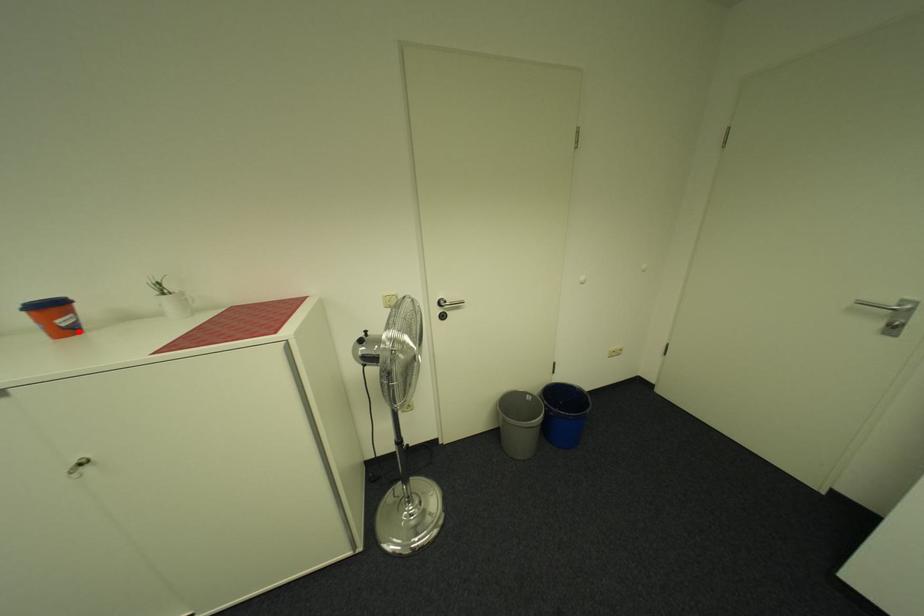
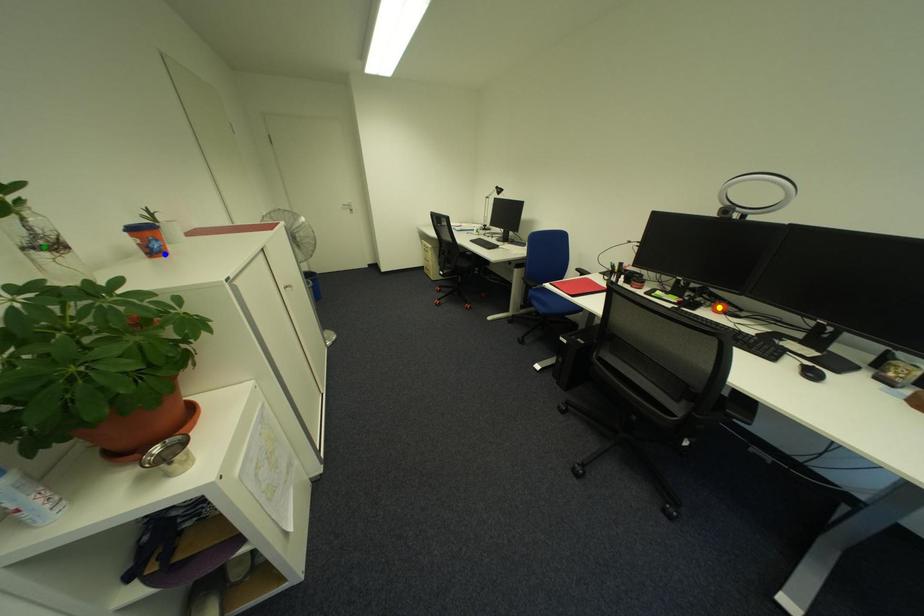
Question: I am providing you with two images of the same scene from different viewpoints. A red point is marked on the first image. You are given multiple points on the second image. Can you choose the point in image 2 that corresponds to the point in image 1?

Choices:
 (A) yellow point
 (B) blue point
 (C) green point

Answer: (B)